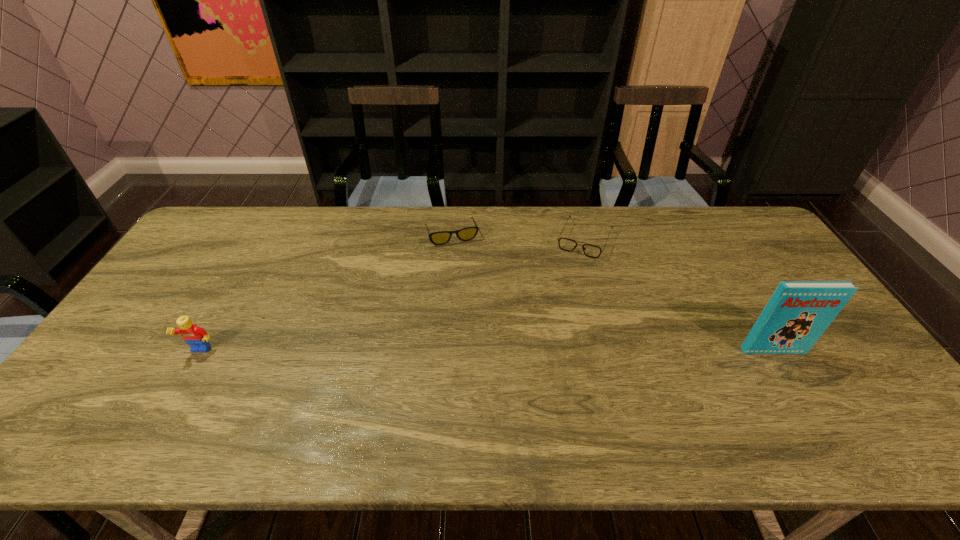
Locate an element on the screen. free space on the desktop that is between the leftmost object and the book and is positioned on the front-facing side of the second object from left to right is located at coordinates (491, 351).

Image resolution: width=960 pixels, height=540 pixels. Find the location of `vacant space on the desktop that is between the third shortest object and the book and is positioned on the front-facing side of the right sunglasses`. vacant space on the desktop that is between the third shortest object and the book and is positioned on the front-facing side of the right sunglasses is located at coordinates (537, 351).